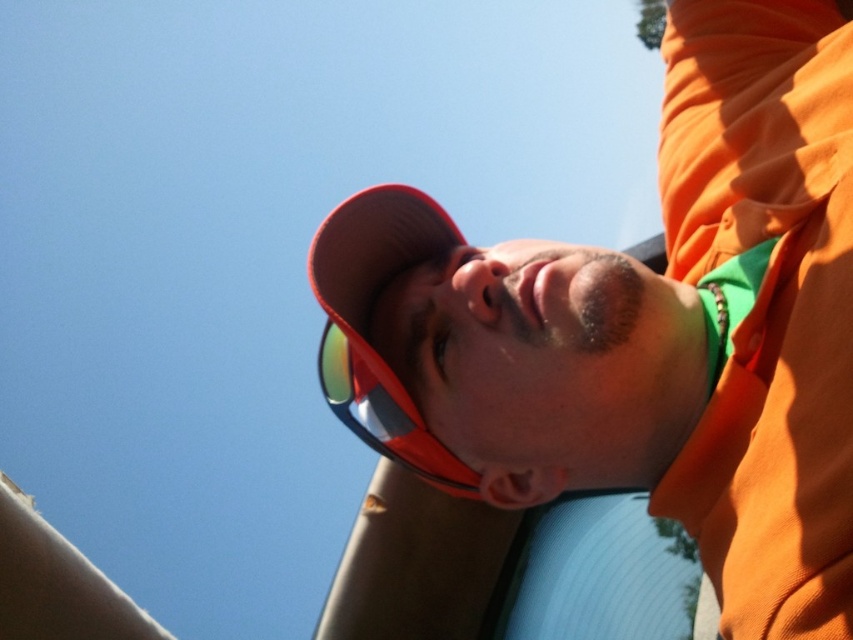
You are a photographer adjusting your camera settings to focus on the matte orange cap at center. Given that the camera focuses best at coordinates between 0.5 and 0.6 on the horizontal axis and between 0.7 and 0.8 on the vertical axis, will the cap be within the optimal focus range?

The matte orange cap at center is located at point 0.550 on the horizontal axis and 0.729 on the vertical axis. Since both coordinates fall within the optimal focus range of 0.5 to 0.6 horizontally and 0.7 to 0.8 vertically, the cap will be within the optimal focus range.

You are a photographer trying to capture the perfect shot of the person wearing the matte orange cap at center and the green reflective lens at center. From the camera position, which object is positioned to the right of the other?

The matte orange cap at center is positioned to the right of the green reflective lens at center.

You are a fashion designer analyzing the image. You need to determine which of the two items, the matte orange cap at center or the green reflective lens at center, has a greater height. Which one is taller?

The matte orange cap at center is taller than the green reflective lens at center according to the description.